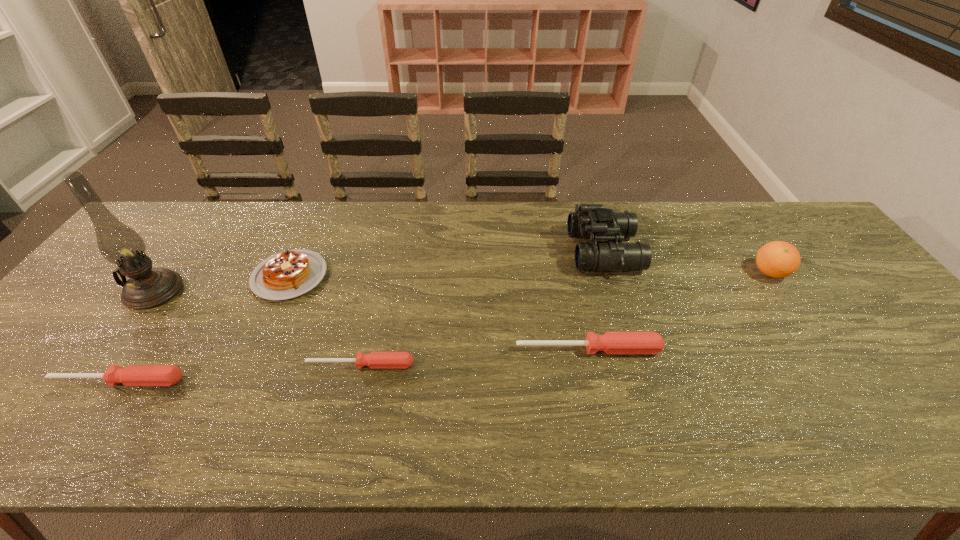
Please point out where to position a new screwdriver on the right to maintain spacing. Please provide its 2D coordinates. Your answer should be formatted as a tuple, i.e. [(x, y)], where the tuple contains the x and y coordinates of a point satisfying the conditions above.

[(804, 335)]